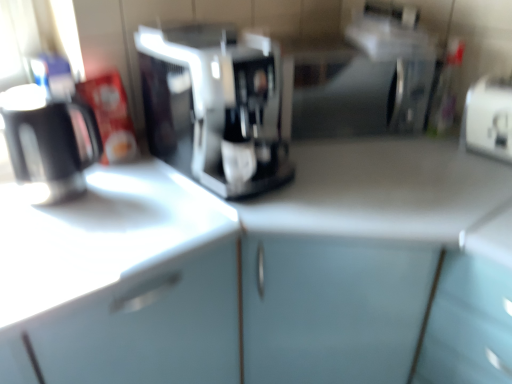
At what (x,y) coordinates should I click in order to perform the action: click on free point above white glossy counter top at left (from a real-world perspective). Please return your answer as a coordinate pair (x, y). Looking at the image, I should click on (81, 207).